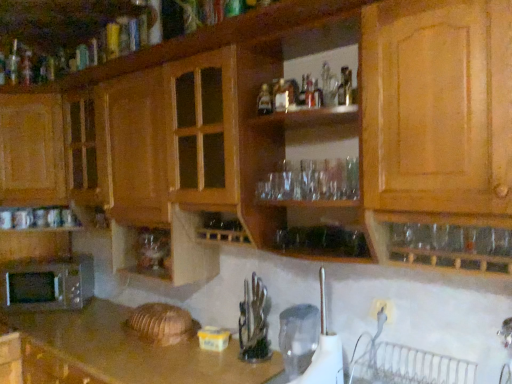
Question: Is transparent plastic pitcher at lower center, which is the second appliance from front to back, in front of or behind clear glass bottle at upper center, placed as the second bottle when sorted from back to front, in the image?

Choices:
 (A) behind
 (B) front

Answer: (A)

Question: In terms of size, does transparent plastic pitcher at lower center, arranged as the 1th appliance when viewed from the back, appear bigger or smaller than clear glass bottle at upper center, which appears as the first bottle when viewed from the front?

Choices:
 (A) big
 (B) small

Answer: (A)

Question: Which is nearer to the wooden cabinet at center, which is counted as the 1th cabinetry, starting from the bottom?

Choices:
 (A) translucent glass bottle at upper center, marked as the first bottle in a left-to-right arrangement
 (B) transparent plastic pitcher at lower center, which is the second appliance from front to back
 (C) wooden cabinet at left, the 2th cabinetry in the top-to-bottom sequence
 (D) silver metallic microwave at lower left
 (E) wooden cabinet at upper center, arranged as the 1th cabinetry when viewed from the top

Answer: (E)

Question: Based on their relative distances, which object is nearer to the transparent plastic pitcher at lower center, arranged as the 1th appliance when viewed from the back?

Choices:
 (A) translucent glass bottle at upper center, the 1th bottle in the back-to-front sequence
 (B) clear glass bottle at upper center, which is the 1th bottle from right to left
 (C) wooden cabinet at upper center, arranged as the 1th cabinetry when viewed from the top
 (D) wooden cabinet at left, the 2th cabinetry in the top-to-bottom sequence
 (E) wooden cabinet at center, the 3th cabinetry viewed from the top

Answer: (E)